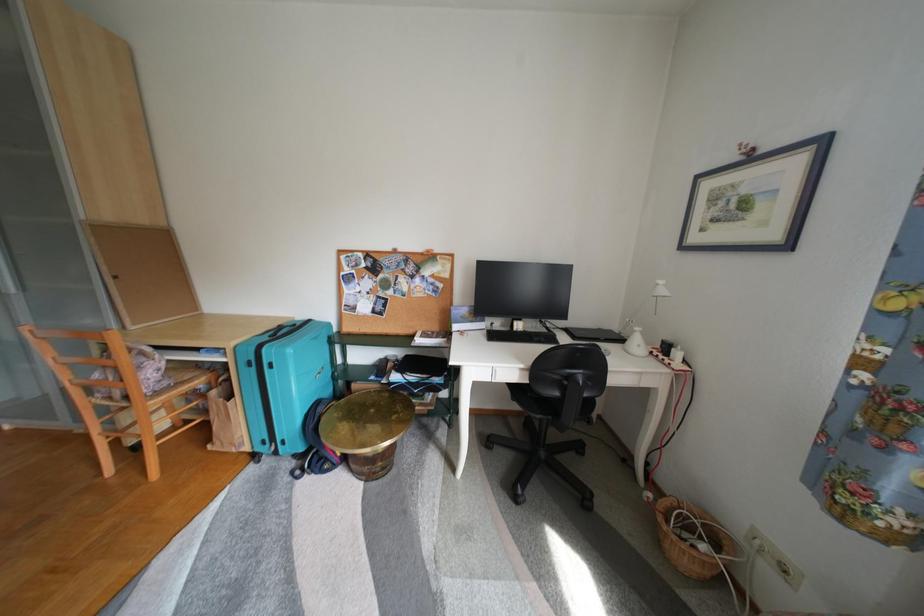
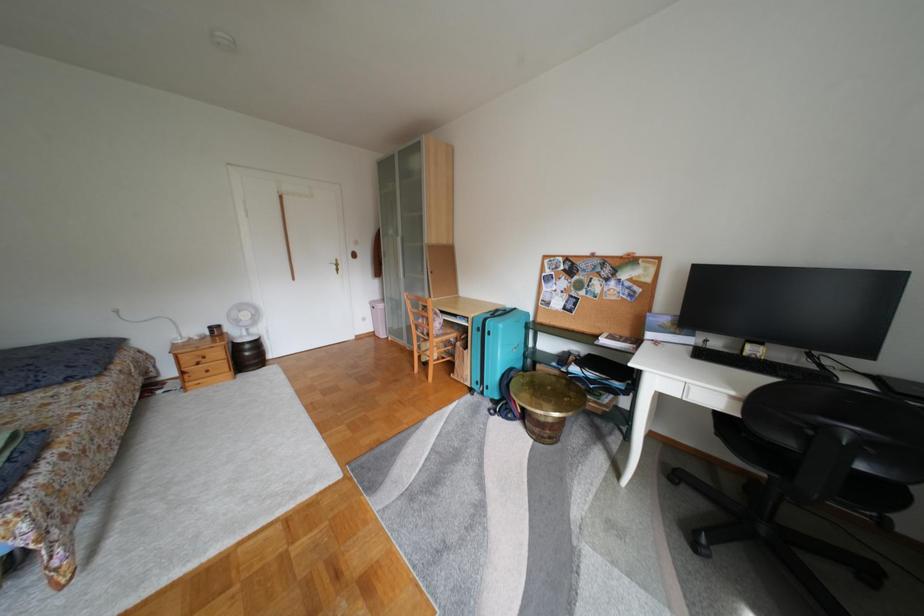
Question: How did the camera likely rotate?

Choices:
 (A) Left
 (B) Right
 (C) Up
 (D) Down

Answer: (A)